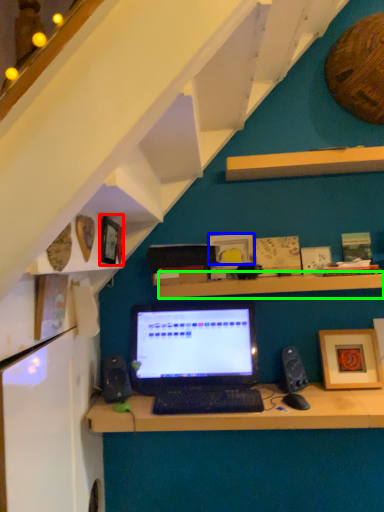
Question: Which is nearer to the picture frame (highlighted by a red box)? picture frame (highlighted by a blue box) or shelf (highlighted by a green box).

Choices:
 (A) picture frame
 (B) shelf

Answer: (B)